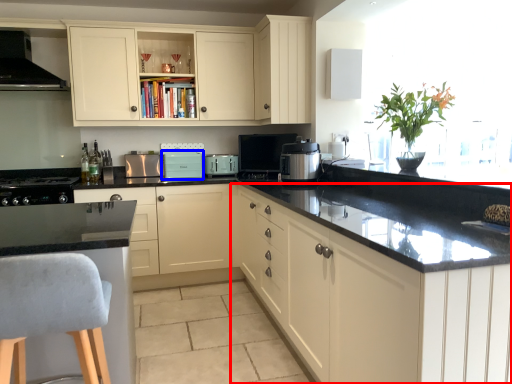
Question: Which object appears farthest to the camera in this image, cabinetry (highlighted by a red box) or appliance (highlighted by a blue box)?

Choices:
 (A) cabinetry
 (B) appliance

Answer: (B)